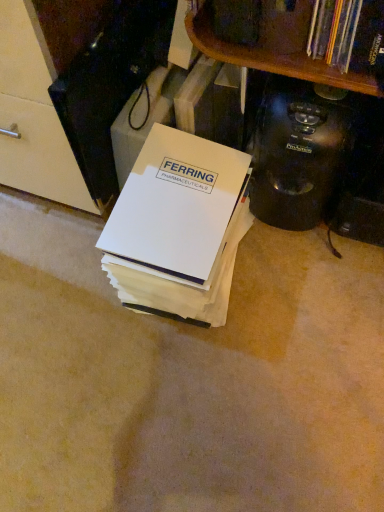
Question: Considering the relative sizes of white paper at center and black plastic coffee maker at right in the image provided, is white paper at center wider than black plastic coffee maker at right?

Choices:
 (A) no
 (B) yes

Answer: (B)

Question: Considering the relative positions of white paper at center and black plastic coffee maker at right in the image provided, is white paper at center behind black plastic coffee maker at right?

Choices:
 (A) yes
 (B) no

Answer: (B)

Question: From a real-world perspective, does white paper at center stand above black plastic coffee maker at right?

Choices:
 (A) yes
 (B) no

Answer: (B)

Question: Does white paper at center have a smaller size compared to black plastic coffee maker at right?

Choices:
 (A) yes
 (B) no

Answer: (B)

Question: Would you say white paper at center is a long distance from black plastic coffee maker at right?

Choices:
 (A) yes
 (B) no

Answer: (B)

Question: From the image's perspective, is white paper at center beneath black plastic coffee maker at right?

Choices:
 (A) yes
 (B) no

Answer: (A)

Question: Does black plastic coffee maker at right have a smaller size compared to white paper at center?

Choices:
 (A) yes
 (B) no

Answer: (A)

Question: Considering the relative sizes of black plastic coffee maker at right and white paper at center in the image provided, is black plastic coffee maker at right wider than white paper at center?

Choices:
 (A) no
 (B) yes

Answer: (A)

Question: From a real-world perspective, is black plastic coffee maker at right located beneath white paper at center?

Choices:
 (A) yes
 (B) no

Answer: (B)

Question: Can you confirm if black plastic coffee maker at right is bigger than white paper at center?

Choices:
 (A) no
 (B) yes

Answer: (A)

Question: Is black plastic coffee maker at right to the left of white paper at center from the viewer's perspective?

Choices:
 (A) yes
 (B) no

Answer: (B)

Question: Could white paper at center be considered to be inside black plastic coffee maker at right?

Choices:
 (A) no
 (B) yes

Answer: (A)

Question: From a real-world perspective, is black plastic coffee maker at right positioned above or below white paper at center?

Choices:
 (A) below
 (B) above

Answer: (B)